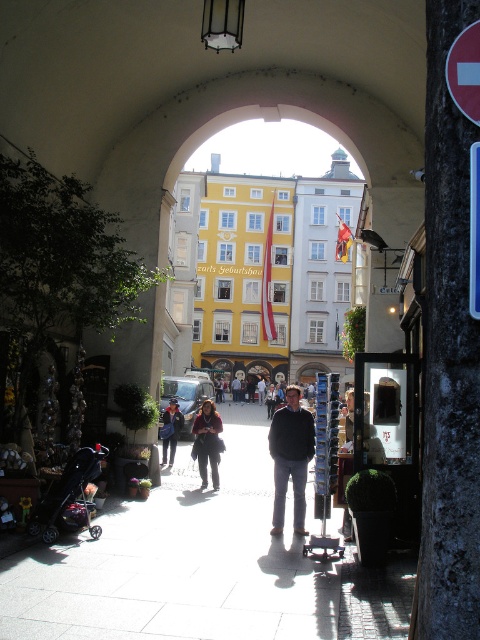
Question: Which point appears closest to the camera in this image?

Choices:
 (A) (294, 412)
 (B) (199, 458)
 (C) (182, 420)

Answer: (A)

Question: Among these objects, which one is farthest from the camera?

Choices:
 (A) denim jacket at center
 (B) dark gray sweater at center

Answer: (A)

Question: Is dark brown leather jacket at center thinner than denim jacket at center?

Choices:
 (A) no
 (B) yes

Answer: (B)

Question: Considering the real-world distances, which object is farthest from the denim jacket at center?

Choices:
 (A) dark brown leather jacket at center
 (B) dark gray sweater at center

Answer: (B)

Question: Is dark brown leather jacket at center to the left of denim jacket at center from the viewer's perspective?

Choices:
 (A) no
 (B) yes

Answer: (A)

Question: Can you confirm if dark gray sweater at center is positioned to the left of denim jacket at center?

Choices:
 (A) no
 (B) yes

Answer: (A)